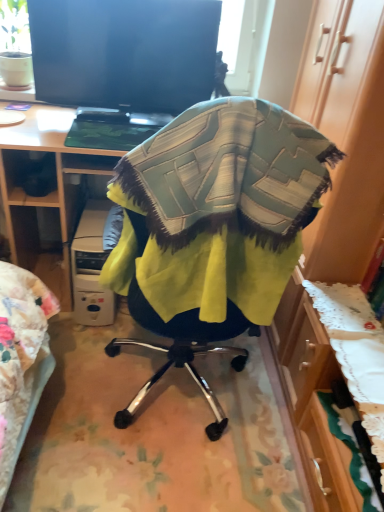
Question: Based on their positions, is black glossy screen at upper center located to the left or right of textured fabric chair at center?

Choices:
 (A) left
 (B) right

Answer: (A)

Question: From a real-world perspective, is black glossy screen at upper center physically located above or below textured fabric chair at center?

Choices:
 (A) below
 (B) above

Answer: (B)

Question: Estimate the real-world distances between objects in this image. Which object is farther from the textured fabric chair at center?

Choices:
 (A) white plastic computer at lower left
 (B) wooden desk at center
 (C) black glossy screen at upper center

Answer: (C)

Question: Which is nearer to the black glossy screen at upper center?

Choices:
 (A) wooden desk at center
 (B) white plastic computer at lower left
 (C) textured fabric chair at center

Answer: (A)